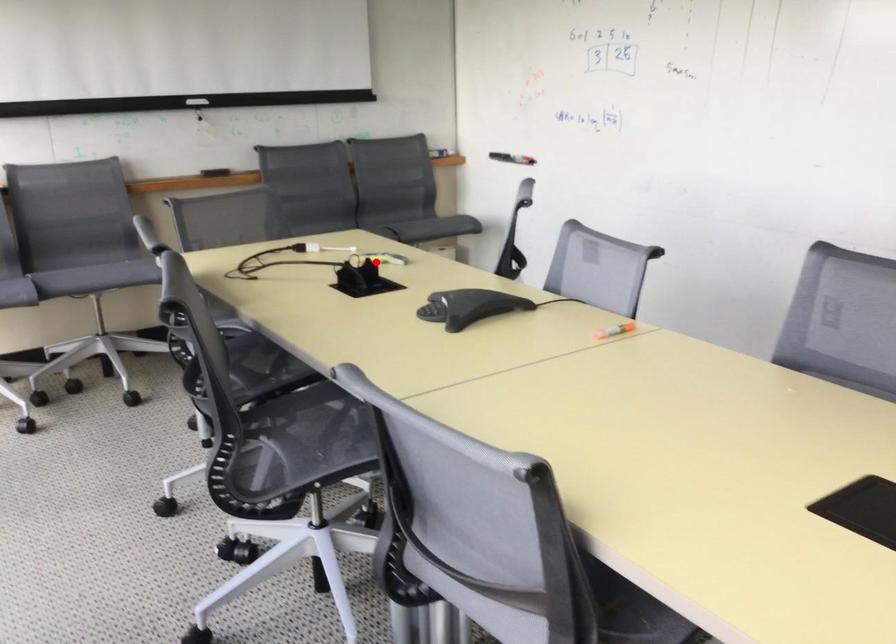
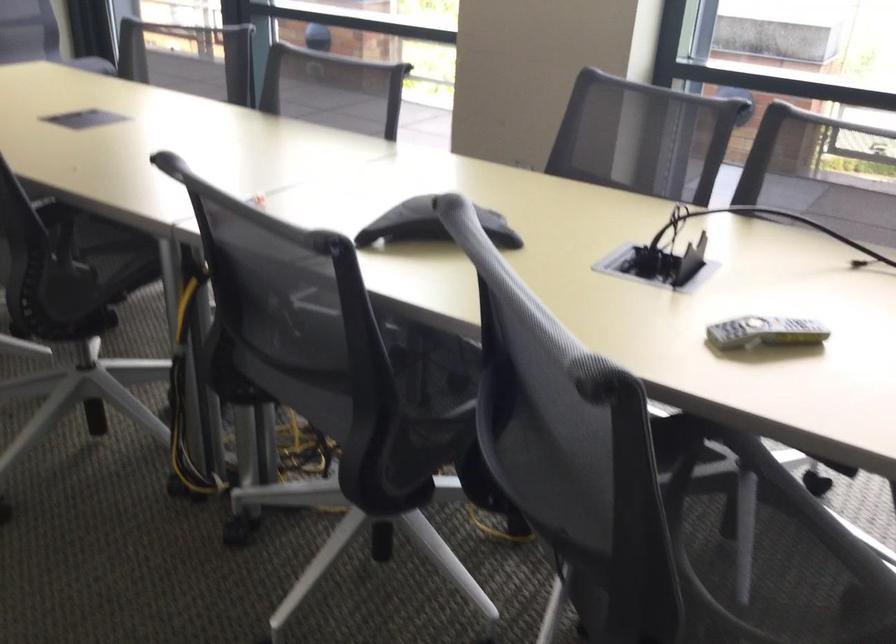
Question: I am providing you with two images of the same scene from different viewpoints. Given a red point in image1, look at the same physical point in image2. Is it:

Choices:
 (A) Closer to the viewpoint
 (B) Farther from the viewpoint

Answer: (A)